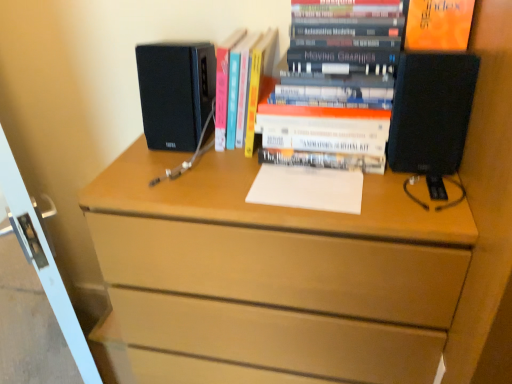
At what (x,y) coordinates should I click in order to perform the action: click on free space above white paper at center (from a real-world perspective). Please return your answer as a coordinate pair (x, y). This screenshot has width=512, height=384. Looking at the image, I should click on (302, 179).